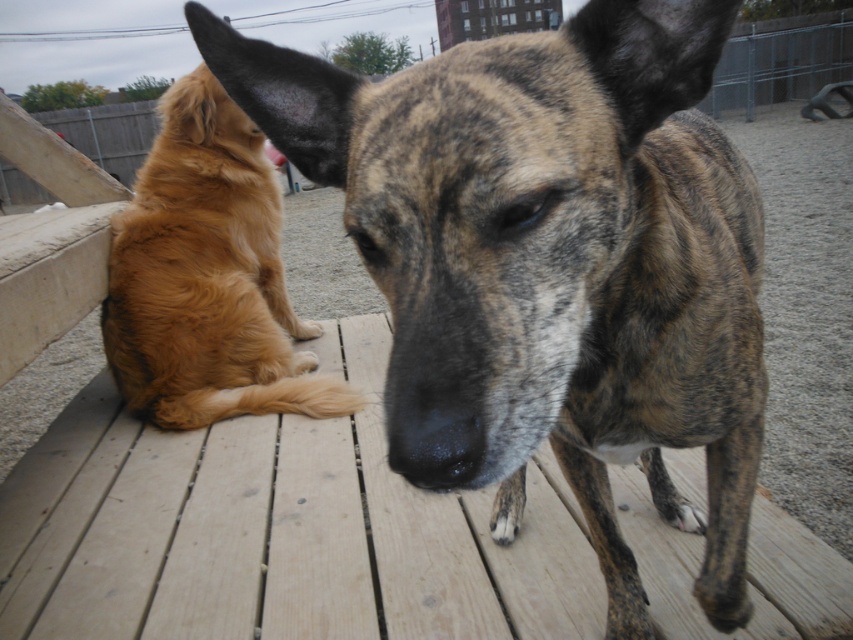
Question: Based on their relative distances, which object is nearer to the golden fur dog at left?

Choices:
 (A) brindle fur dog at center
 (B) black smooth nose at center

Answer: (A)

Question: Is brindle fur dog at center wider than black smooth nose at center?

Choices:
 (A) yes
 (B) no

Answer: (A)

Question: Is golden fur dog at left below black smooth nose at center?

Choices:
 (A) no
 (B) yes

Answer: (A)

Question: Based on their relative distances, which object is nearer to the brindle fur dog at center?

Choices:
 (A) golden fur dog at left
 (B) black smooth nose at center

Answer: (B)

Question: Does brindle fur dog at center appear under black smooth nose at center?

Choices:
 (A) no
 (B) yes

Answer: (A)

Question: Which point is farther from the camera taking this photo?

Choices:
 (A) (387, 458)
 (B) (563, 323)

Answer: (B)